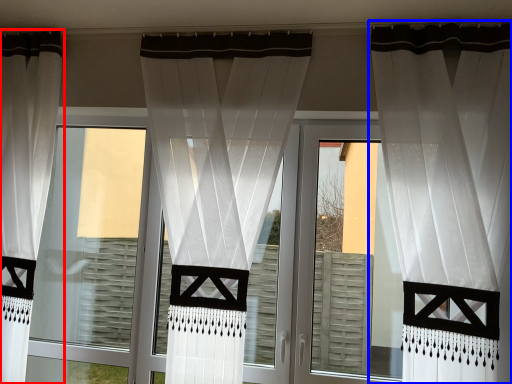
Question: Which object appears farthest to the camera in this image, curtain (highlighted by a red box) or curtain (highlighted by a blue box)?

Choices:
 (A) curtain
 (B) curtain

Answer: (A)